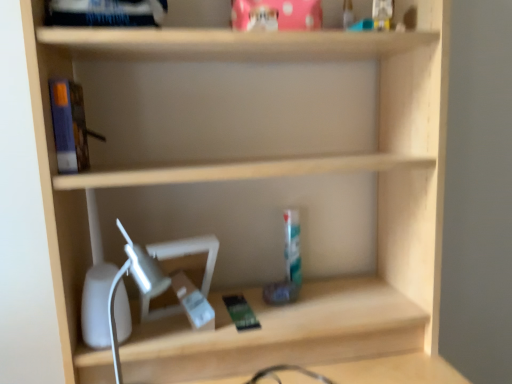
What are the coordinates of `white plastic table lamp at lower left` in the screenshot? It's located at (136, 283).

This screenshot has width=512, height=384. What do you see at coordinates (136, 283) in the screenshot?
I see `white plastic table lamp at lower left` at bounding box center [136, 283].

What do you see at coordinates (69, 125) in the screenshot?
I see `blue matte book at left` at bounding box center [69, 125].

Measure the distance between blue matte book at left and camera.

31.73 inches.

This screenshot has width=512, height=384. Find the location of `blue matte book at left`. blue matte book at left is located at coordinates (69, 125).

What is the approximate height of blue matte book at left?

7.40 inches.

You are a GUI agent. You are given a task and a screenshot of the screen. Output one action in this format:
    pyautogui.click(x=<x>, y=<y>)
    Task: Click on the white plastic table lamp at lower left
    The image size is (512, 384).
    Given the screenshot: What is the action you would take?
    pyautogui.click(x=136, y=283)

Does white plastic table lamp at lower left appear on the right side of blue matte book at left?

Indeed, white plastic table lamp at lower left is positioned on the right side of blue matte book at left.

Considering the positions of objects white plastic table lamp at lower left and blue matte book at left in the image provided, who is in front, white plastic table lamp at lower left or blue matte book at left?

white plastic table lamp at lower left is more forward.

Is point (108, 299) positioned in front of point (63, 150)?

No, it is not.

From the image's perspective, is white plastic table lamp at lower left on top of blue matte book at left?

Actually, white plastic table lamp at lower left appears below blue matte book at left in the image.

From a real-world perspective, relative to blue matte book at left, is white plastic table lamp at lower left vertically above or below?

In terms of real-world spatial position, white plastic table lamp at lower left is below blue matte book at left.

Considering the relative sizes of white plastic table lamp at lower left and blue matte book at left in the image provided, is white plastic table lamp at lower left wider than blue matte book at left?

Correct, the width of white plastic table lamp at lower left exceeds that of blue matte book at left.

Does white plastic table lamp at lower left have a lesser height compared to blue matte book at left?

In fact, white plastic table lamp at lower left may be taller than blue matte book at left.

Who is bigger, white plastic table lamp at lower left or blue matte book at left?

white plastic table lamp at lower left is bigger.

Is white plastic table lamp at lower left inside or outside of blue matte book at left?

white plastic table lamp at lower left is spatially situated outside blue matte book at left.

Is white plastic table lamp at lower left touching blue matte book at left?

No, white plastic table lamp at lower left is not in contact with blue matte book at left.

Could you tell me if white plastic table lamp at lower left is turned towards blue matte book at left?

No, white plastic table lamp at lower left is not facing towards blue matte book at left.

How different are the orientations of white plastic table lamp at lower left and blue matte book at left in degrees?

white plastic table lamp at lower left and blue matte book at left are facing 0.000661 degrees away from each other.

Find the location of a particular element. table lamp on the right of the blue matte book at left is located at coordinates (136, 283).

Which object is positioned more to the right, blue matte book at left or white plastic table lamp at lower left?

white plastic table lamp at lower left is more to the right.

Does blue matte book at left lie in front of white plastic table lamp at lower left?

No, blue matte book at left is further to the viewer.

Between point (60, 159) and point (138, 255), which one is positioned behind?

Point (60, 159)

From the image's perspective, who appears lower, blue matte book at left or white plastic table lamp at lower left?

white plastic table lamp at lower left.

From a real-world perspective, which is physically below, blue matte book at left or white plastic table lamp at lower left?

white plastic table lamp at lower left.

From the picture: Which of these two, blue matte book at left or white plastic table lamp at lower left, is thinner?

blue matte book at left.

Does blue matte book at left have a greater height compared to white plastic table lamp at lower left?

No, blue matte book at left is not taller than white plastic table lamp at lower left.

Considering the sizes of objects blue matte book at left and white plastic table lamp at lower left in the image provided, who is smaller, blue matte book at left or white plastic table lamp at lower left?

Smaller between the two is blue matte book at left.

Would you say blue matte book at left is inside or outside white plastic table lamp at lower left?

blue matte book at left is spatially situated outside white plastic table lamp at lower left.

Is blue matte book at left in contact with white plastic table lamp at lower left?

No, blue matte book at left is not making contact with white plastic table lamp at lower left.

Does blue matte book at left turn towards white plastic table lamp at lower left?

No, blue matte book at left is not aimed at white plastic table lamp at lower left.

How many degrees apart are the facing directions of blue matte book at left and white plastic table lamp at lower left?

The angle between the facing direction of blue matte book at left and the facing direction of white plastic table lamp at lower left is 0.000661 degrees.

The height and width of the screenshot is (384, 512). What are the coordinates of `table lamp below the blue matte book at left (from the image's perspective)` in the screenshot? It's located at (136, 283).

Find the location of a particular element. table lamp beneath the blue matte book at left (from a real-world perspective) is located at coordinates (136, 283).

Identify the location of book behind the white plastic table lamp at lower left. (69, 125).